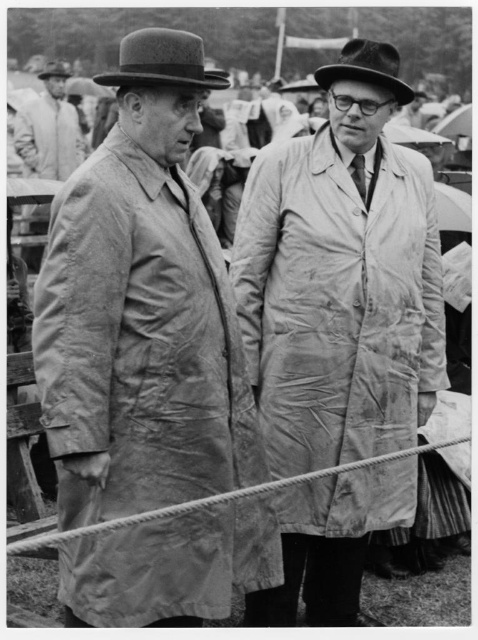
Who is positioned more to the right, matte black hat at upper left or matte black hat at upper right?

matte black hat at upper right is more to the right.

Consider the image. How far apart are matte black hat at upper left and matte black hat at upper right?

matte black hat at upper left is 37.01 inches away from matte black hat at upper right.

Image resolution: width=478 pixels, height=640 pixels. Describe the element at coordinates (162, 61) in the screenshot. I see `matte black hat at upper left` at that location.

I want to click on matte black hat at upper left, so tap(162, 61).

Can you confirm if matte gray trench coat at center is shorter than light gray coat at upper left?

In fact, matte gray trench coat at center may be taller than light gray coat at upper left.

Is matte gray trench coat at center positioned at the back of light gray coat at upper left?

No, it is not.

Measure the distance between matte gray trench coat at center and camera.

They are 3.30 meters apart.

Identify the location of matte gray trench coat at center. (140, 342).

Consider the image. Who is lower down, matte black hat at upper left or matte brown hat at upper left?

matte black hat at upper left

Between matte black hat at upper left and matte brown hat at upper left, which one appears on the right side from the viewer's perspective?

Positioned to the right is matte black hat at upper left.

Does point (177, 48) lie behind point (52, 76)?

No.

Locate an element on the screen. The height and width of the screenshot is (640, 478). matte black hat at upper left is located at coordinates (162, 61).